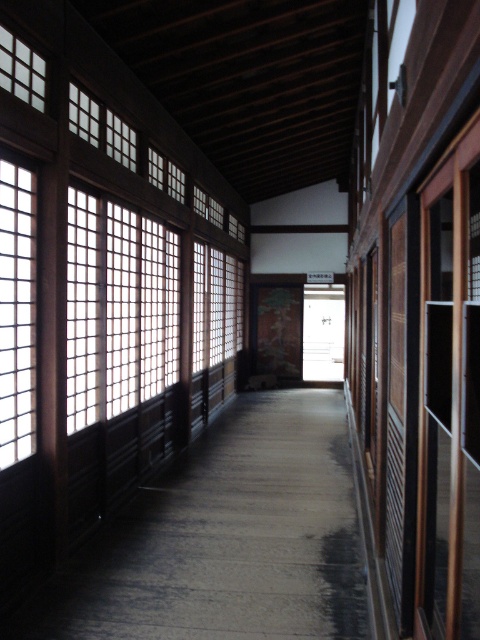
You are standing at the entrance of the corridor and want to find the white grid screen at center. According to the scene description, where should you look relative to your position?

The white grid screen at center is located at point coordinates 0.483 on the x axis and 0.246 on the y axis, so you should look towards the center of the corridor to find it.

You are standing in the traditional Japanese corridor and want to move from one point to another. If you start at point (85, 97) and walk towards point (6, 384), will you be moving forward in the corridor?

Yes, because point (6, 384) is in front of point (85, 97), so moving towards it means you are moving forward in the corridor.

You are an architect designing a replica of this corridor and need to ensure the dimensions are accurate. Which of the two translucent wooden grids, the translucent wooden grid at left or the translucent wooden grid at upper left, has a smaller width?

The translucent wooden grid at left has a smaller width than the translucent wooden grid at upper left according to the description.